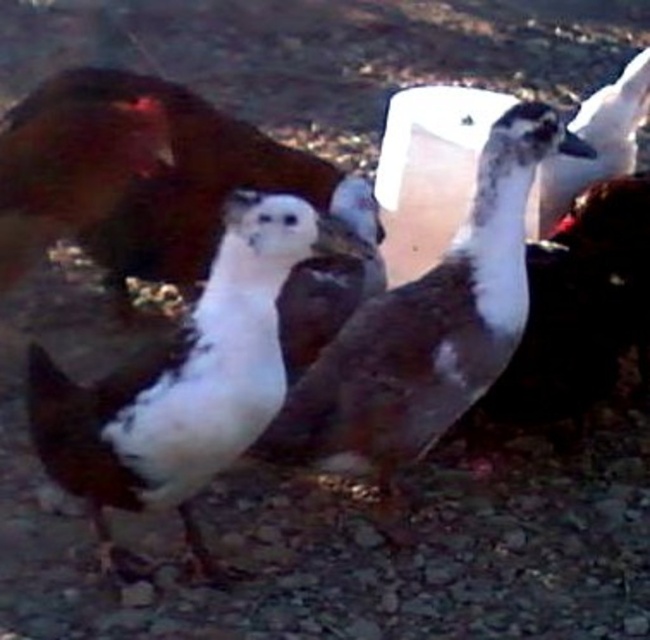
You are a photographer aiming to capture a clear photo of the white matte duck at center and the brown matte duck at center. Since the background is blurred, which duck will appear more in focus in the photo?

The white matte duck at center will appear more in focus because it is in front of the brown matte duck at center, so it is closer to the camera.

You are a farmer checking the coop and you see the white matte duck at center and the brown matte duck at center. You need to place a divider between them that is 10 inches wide. Will the divider fit between them?

The distance between the white matte duck at center and the brown matte duck at center is 10.70 inches, so a 10 inch divider can fit between them since it is slightly narrower than the space available.